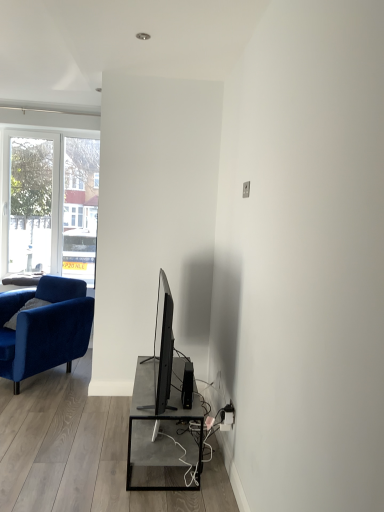
Question: Does black plastic speaker at lower center appear on the right side of velvet blue armchair at left?

Choices:
 (A) no
 (B) yes

Answer: (B)

Question: Are black plastic speaker at lower center and velvet blue armchair at left beside each other?

Choices:
 (A) yes
 (B) no

Answer: (B)

Question: Does black plastic speaker at lower center have a lesser height compared to velvet blue armchair at left?

Choices:
 (A) no
 (B) yes

Answer: (B)

Question: Is black plastic speaker at lower center far from velvet blue armchair at left?

Choices:
 (A) no
 (B) yes

Answer: (B)

Question: Considering the relative sizes of black plastic speaker at lower center and velvet blue armchair at left in the image provided, is black plastic speaker at lower center thinner than velvet blue armchair at left?

Choices:
 (A) yes
 (B) no

Answer: (A)

Question: From the image's perspective, is black plastic speaker at lower center located above velvet blue armchair at left?

Choices:
 (A) yes
 (B) no

Answer: (B)

Question: Considering the relative sizes of velvet blue armchair at left and black plastic speaker at lower center in the image provided, is velvet blue armchair at left thinner than black plastic speaker at lower center?

Choices:
 (A) yes
 (B) no

Answer: (B)

Question: From a real-world perspective, is velvet blue armchair at left physically above black plastic speaker at lower center?

Choices:
 (A) no
 (B) yes

Answer: (A)

Question: Is velvet blue armchair at left not within black plastic speaker at lower center?

Choices:
 (A) yes
 (B) no

Answer: (A)

Question: From a real-world perspective, is velvet blue armchair at left under black plastic speaker at lower center?

Choices:
 (A) yes
 (B) no

Answer: (A)

Question: Is velvet blue armchair at left facing away from black plastic speaker at lower center?

Choices:
 (A) yes
 (B) no

Answer: (B)

Question: Is velvet blue armchair at left behind black plastic speaker at lower center?

Choices:
 (A) no
 (B) yes

Answer: (B)

Question: Looking at their shapes, would you say black plastic speaker at lower center is wider or thinner than velvet blue armchair at left?

Choices:
 (A) wide
 (B) thin

Answer: (B)